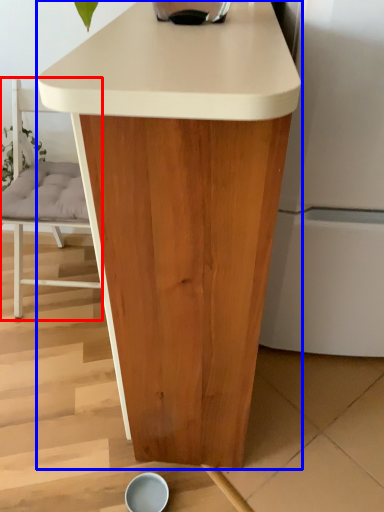
Question: Which object appears closest to the camera in this image, chair (highlighted by a red box) or table (highlighted by a blue box)?

Choices:
 (A) chair
 (B) table

Answer: (B)